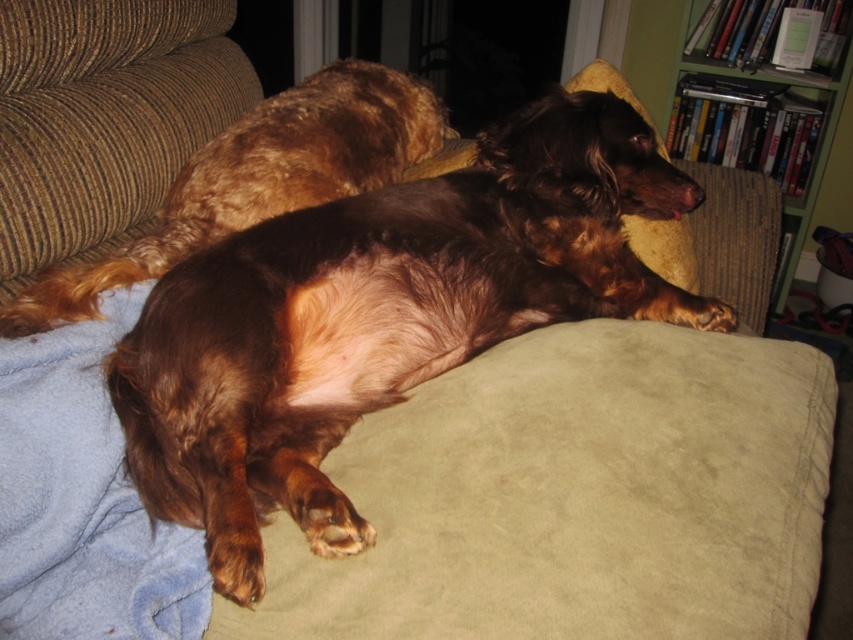
Is brown shaggy dog at center to the right of blue fleece blanket at lower left from the viewer's perspective?

Indeed, brown shaggy dog at center is positioned on the right side of blue fleece blanket at lower left.

Is brown shaggy dog at center above blue fleece blanket at lower left?

Correct, brown shaggy dog at center is located above blue fleece blanket at lower left.

What do you see at coordinates (379, 317) in the screenshot?
I see `brown shaggy dog at center` at bounding box center [379, 317].

Where is `brown shaggy dog at center`? Image resolution: width=853 pixels, height=640 pixels. brown shaggy dog at center is located at coordinates (379, 317).

Who is positioned more to the left, brown shaggy dog at center or green wood bookshelf at upper right?

From the viewer's perspective, brown shaggy dog at center appears more on the left side.

Between point (538, 266) and point (840, 70), which one is positioned behind?

The point (840, 70) is more distant.

Identify the location of brown shaggy dog at center. This screenshot has height=640, width=853. point(379,317).

Who is shorter, blue fleece blanket at lower left or shiny brown fur at center?

Standing shorter between the two is blue fleece blanket at lower left.

Is point (67, 333) closer to viewer compared to point (341, 186)?

Yes.

Describe the element at coordinates (83, 499) in the screenshot. I see `blue fleece blanket at lower left` at that location.

Locate an element on the screen. The width and height of the screenshot is (853, 640). blue fleece blanket at lower left is located at coordinates (83, 499).